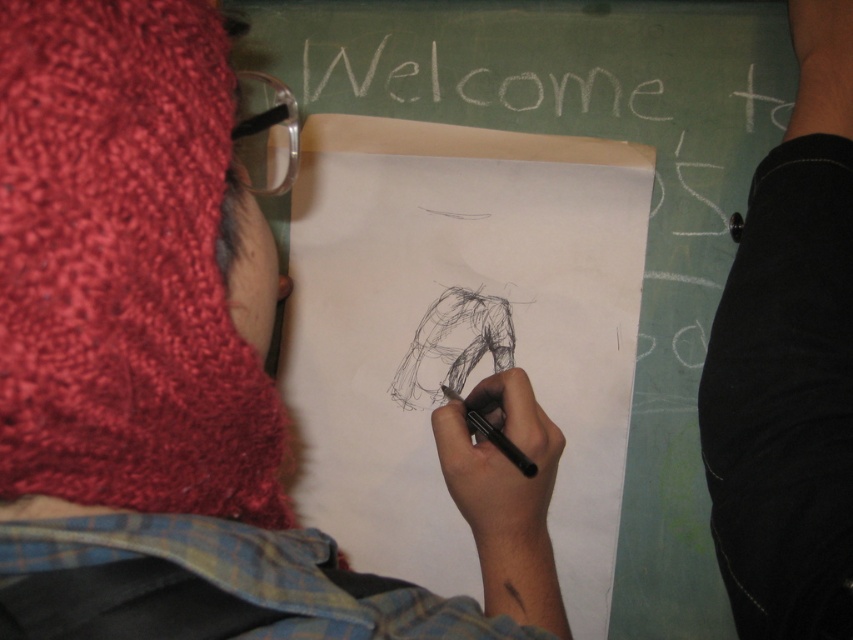
You are a tailor measuring fabric for a new pair of pants. You have a piece of fabric that is exactly the same size as the black smooth pen at center. Can you use this fabric to make the black fabric pants at lower right?

The black fabric pants at lower right has a larger size compared to the black smooth pen at center, so the fabric provided is not sufficient to make the black fabric pants at lower right.

You are a fashion designer analyzing the image. You need to decide which item is larger in size between the knitted wool hat at upper left and the black fabric pants at lower right. Which one is bigger?

The knitted wool hat at upper left is bigger than the black fabric pants at lower right according to the description.

You are an artist trying to locate your black smooth pen at center. You see a knitted wool hat at upper left. Which direction should you move your hand to reach the pen?

The knitted wool hat at upper left is to the left of black smooth pen at center, so you should move your hand to the right to reach the pen.